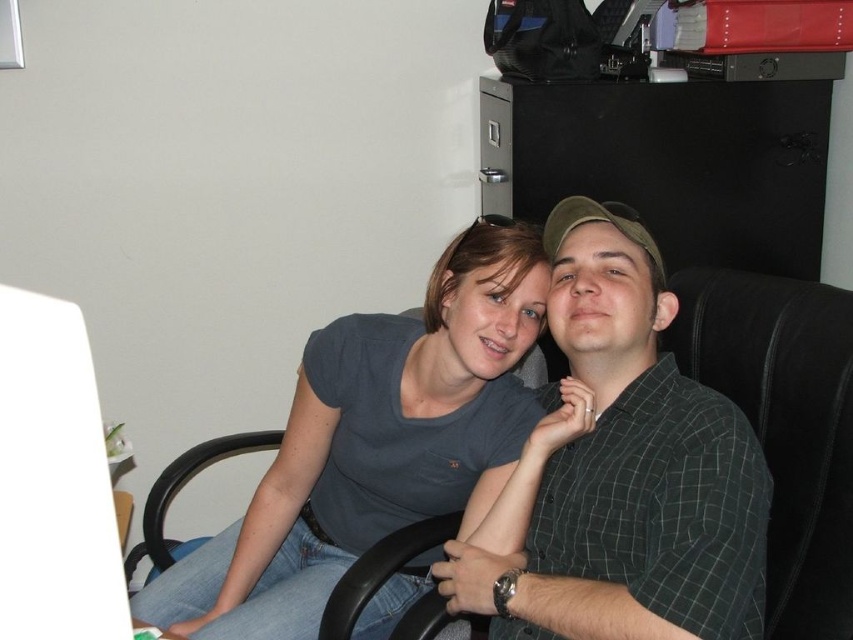
Question: Does gray matte t-shirt at center appear under black leather computer chair at center?

Choices:
 (A) no
 (B) yes

Answer: (A)

Question: From the image, what is the correct spatial relationship of gray matte t-shirt at center in relation to black leather computer chair at center?

Choices:
 (A) right
 (B) left

Answer: (A)

Question: Is gray matte t-shirt at center to the right of black leather computer chair at center from the viewer's perspective?

Choices:
 (A) no
 (B) yes

Answer: (B)

Question: Among these points, which one is farthest from the camera?

Choices:
 (A) 256,545
 (B) 177,476

Answer: (B)

Question: Which point is farther to the camera?

Choices:
 (A) (575, 536)
 (B) (230, 621)
 (C) (148, 588)

Answer: (C)

Question: Estimate the real-world distances between objects in this image. Which object is farther from the black leather computer chair at center?

Choices:
 (A) gray matte t-shirt at center
 (B) green checkered shirt at center

Answer: (B)